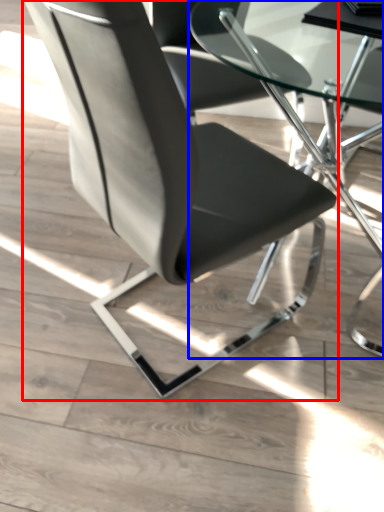
Question: Which object is closer to the camera taking this photo, chair (highlighted by a red box) or table (highlighted by a blue box)?

Choices:
 (A) chair
 (B) table

Answer: (A)